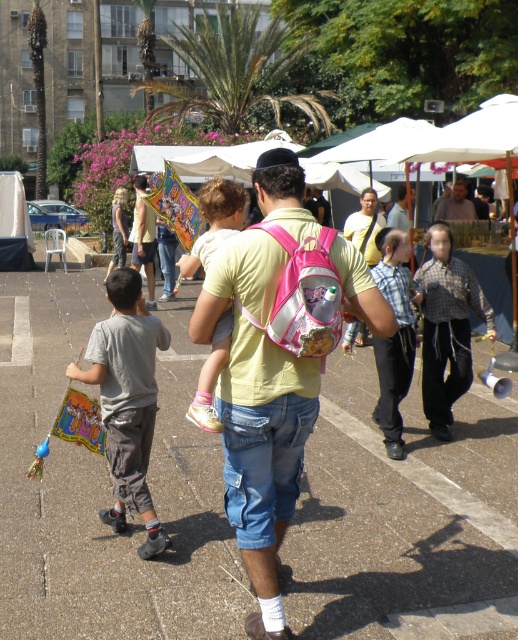
You are a photographer at the market scene. You need to capture a photo of the man and child. The pink fabric backpack at center and checkered shirt at center are both in the frame. According to the description, which object is positioned lower in the image?

The pink fabric backpack at center is located below the checkered shirt at center, so it is positioned lower in the image.

You are standing at the point labeled as point [424,396] and want to walk towards the man carrying the child. Which direction should you move relative to the other point labeled point [262,250]?

You should move towards the direction of point [262,250] because it is in front of point [424,396], meaning it is closer to your current position.

You are a photographer at the market and want to capture both the pink fabric backpack at center and the gray cotton shirt at left in a single photo. Which object should you focus on first to ensure both are in frame?

You should focus on the pink fabric backpack at center first since it is in front of the gray cotton shirt at left, ensuring both will be captured in the photo.